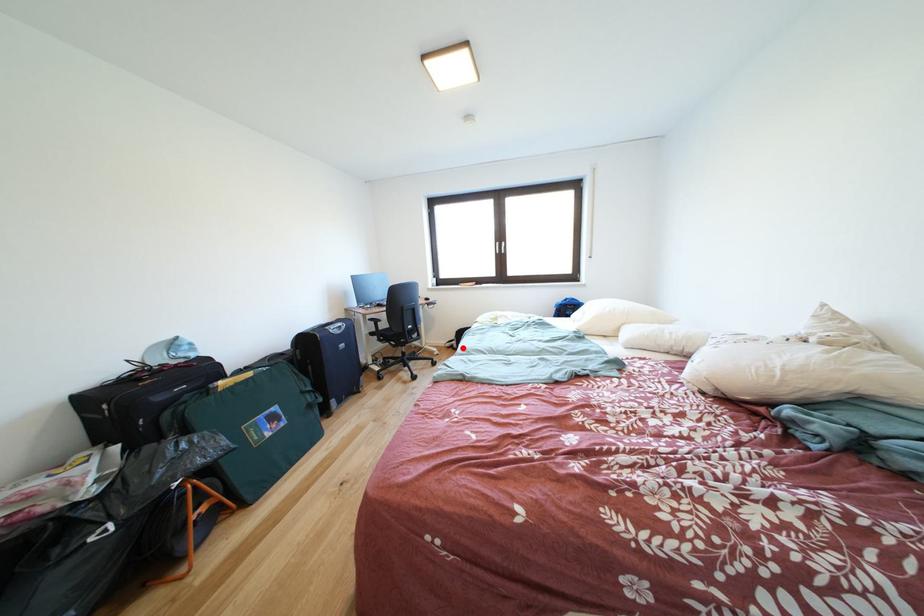
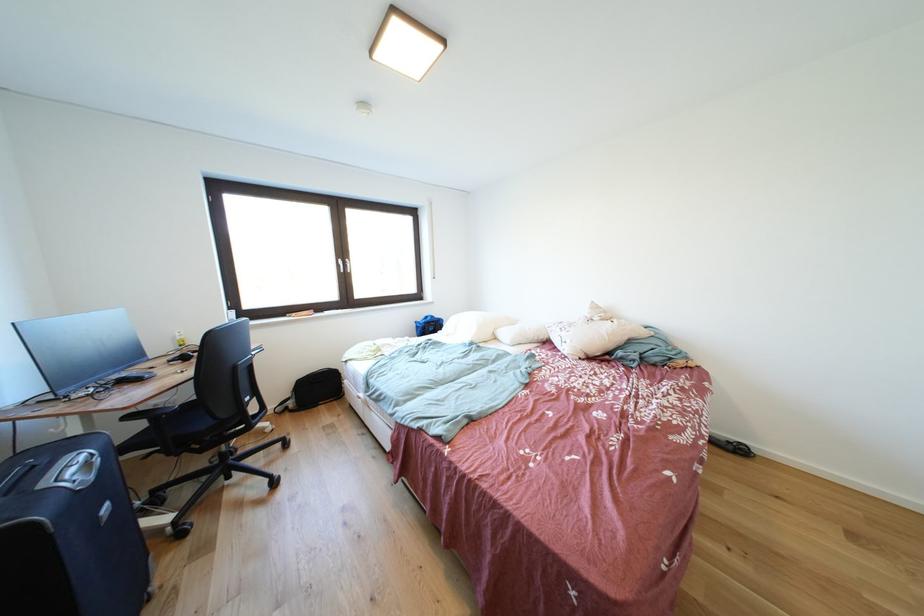
Where in the second image is the point corresponding to the highlighted location from the first image?

(299, 408)